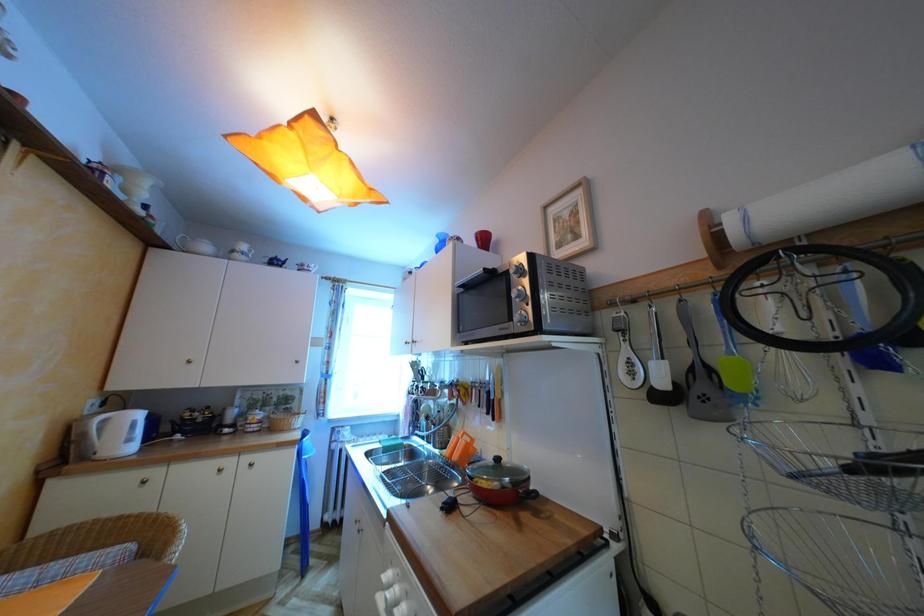
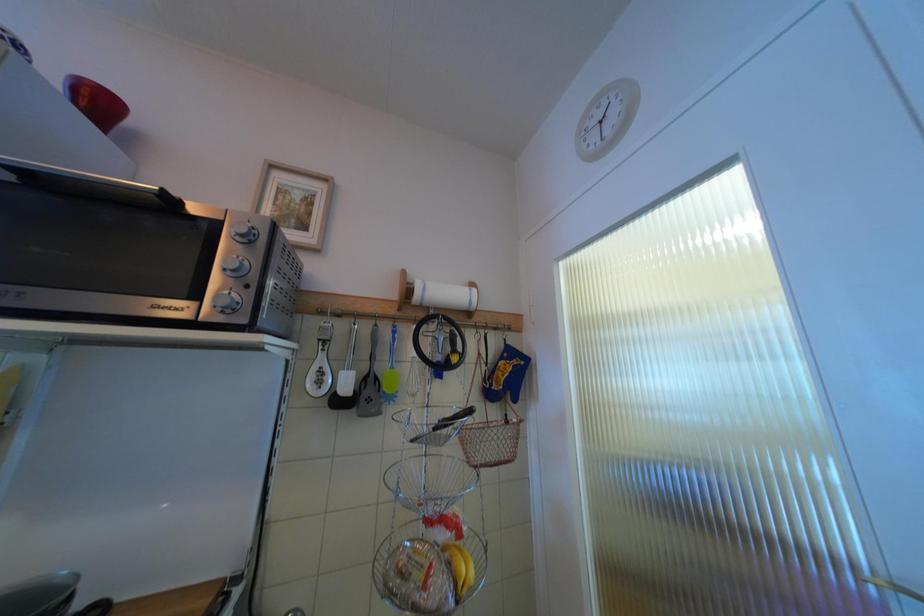
Question: The camera is either moving clockwise (left) or counter-clockwise (right) around the object. The first image is from the beginning of the video and the second image is from the end. Is the camera moving left or right when shooting the video?

Choices:
 (A) Left
 (B) Right

Answer: (A)